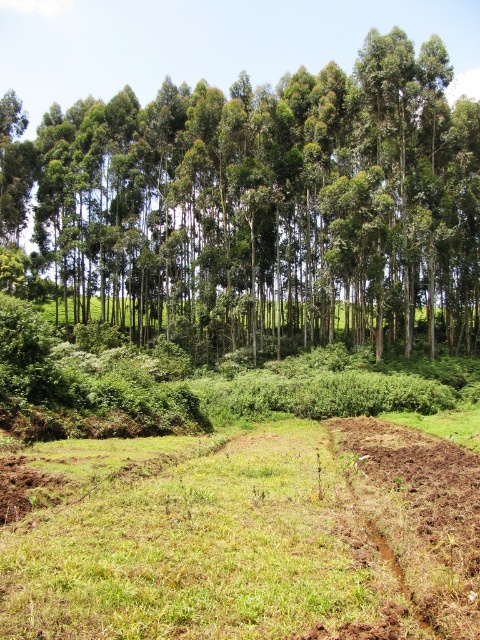
Is the position of green leafy trees at upper center less distant than that of brown soil at lower right?

No, green leafy trees at upper center is behind brown soil at lower right.

Based on the photo, who is shorter, green leafy trees at upper center or brown soil at lower right?

brown soil at lower right

Which is behind, point (409, 173) or point (421, 467)?

The point (409, 173) is behind.

I want to click on green leafy trees at upper center, so click(x=261, y=205).